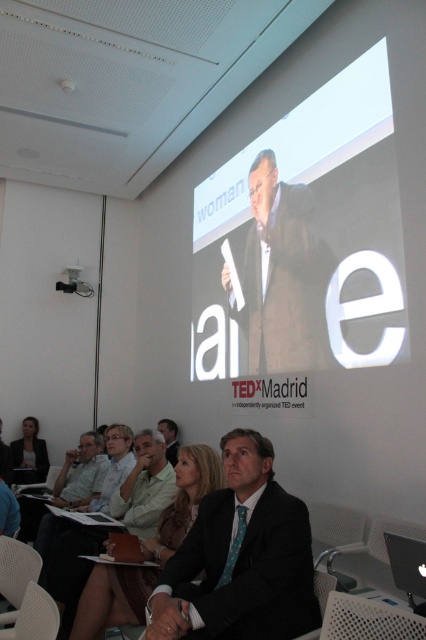
You are an event organizer at the TEDx Madrid event. You need to ensure that there is enough space between the dark gray suit at center and the white fabric chair at lower left for an attendee to comfortably move through the aisle. The minimum required distance for comfortable movement is 75 centimeters. Can the attendee move comfortably between them?

The dark gray suit at center is 85.63 centimeters away from the white fabric chair at lower left. Since the minimum required distance for comfortable movement is 75 centimeters, the attendee can move comfortably between them as the distance exceeds the required threshold.

You are sitting in the front row of the TEDx Madrid event and notice a dark brown leather jacket at center. If you want to retrieve it without leaving your seat, can you reach it?

The dark brown leather jacket at center is 8.09 feet from viewer, so you cannot reach it from your seat without moving.